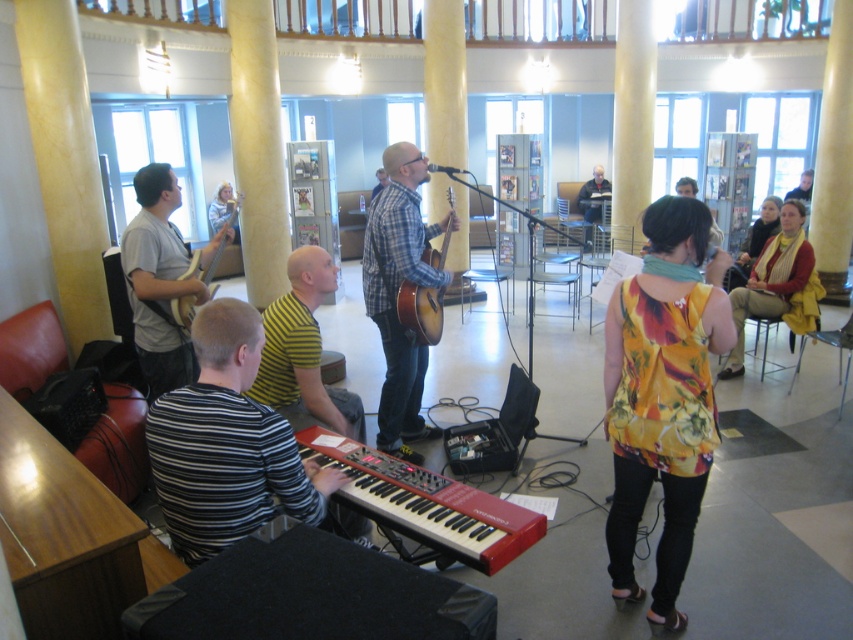
Is point (398, 417) closer to viewer compared to point (331, 262)?

No, it is behind (331, 262).

Does point (383, 349) come in front of point (296, 256)?

No, it is behind (296, 256).

Image resolution: width=853 pixels, height=640 pixels. What are the coordinates of `plaid shirt at center` in the screenshot? It's located at (397, 291).

Is point (254, 317) farther from camera compared to point (296, 378)?

No, it is in front of (296, 378).

Which of these two, striped fabric keyboard at lower left or yellow striped shirt at center, stands shorter?

With less height is striped fabric keyboard at lower left.

Is point (225, 470) farther from viewer compared to point (317, 344)?

No, it is in front of (317, 344).

Locate an element on the screen. The width and height of the screenshot is (853, 640). striped fabric keyboard at lower left is located at coordinates (227, 444).

Who is positioned more to the left, floral print blouse at center or yellow striped shirt at center?

Positioned to the left is yellow striped shirt at center.

Does floral print blouse at center appear under yellow striped shirt at center?

No, floral print blouse at center is not below yellow striped shirt at center.

Identify the location of floral print blouse at center. (663, 396).